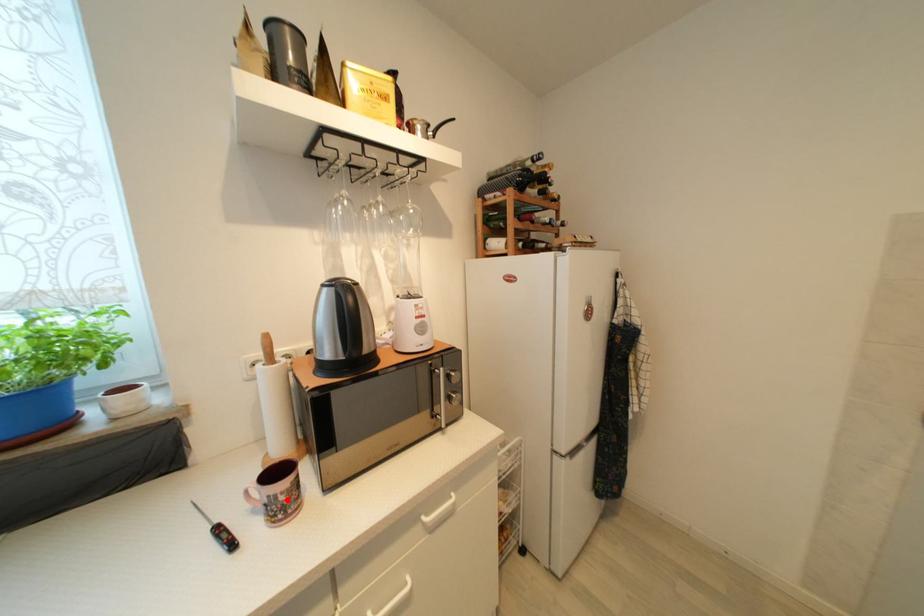
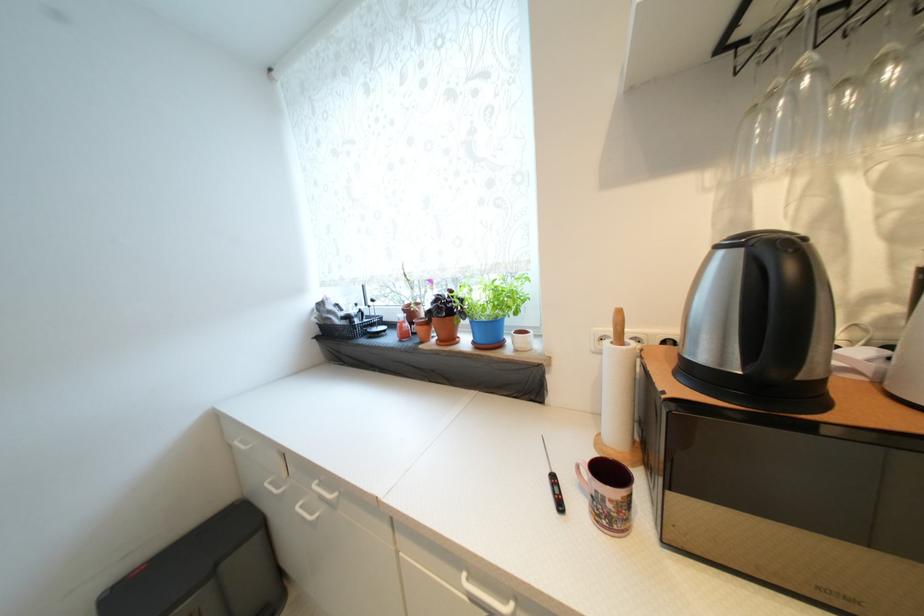
Where in the second image is the point corresponding to the highlighted location from the first image?

(614, 508)